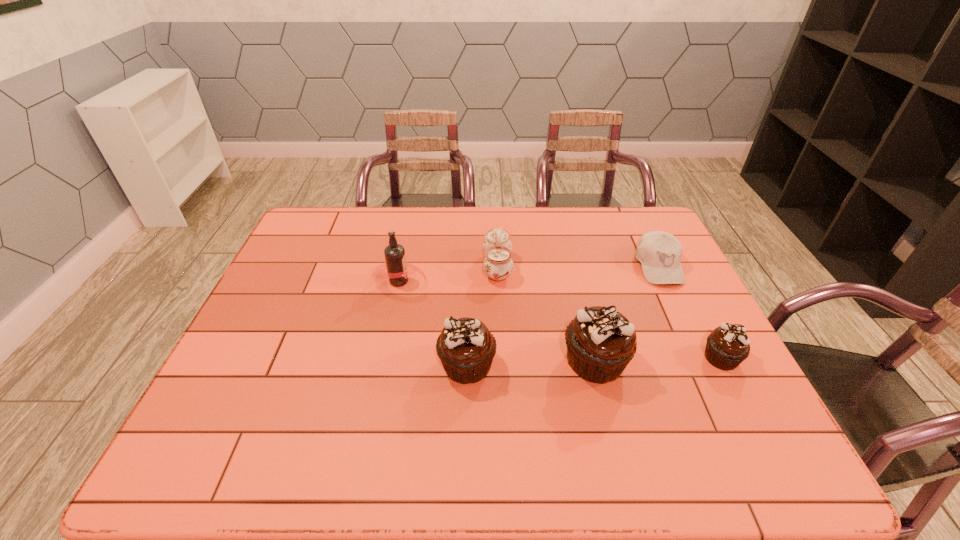
Identify the location of free point that satisfies the following two spatial constraints: 1. on the front-facing side of the baseball cap; 2. by the handle of the chinaware. (659, 267).

Where is `vacant space that satisfies the following two spatial constraints: 1. on the front-facing side of the baseball cap; 2. on the label of the leftmost object`? This screenshot has height=540, width=960. vacant space that satisfies the following two spatial constraints: 1. on the front-facing side of the baseball cap; 2. on the label of the leftmost object is located at coordinates (665, 281).

I want to click on vacant space that satisfies the following two spatial constraints: 1. on the label of the root beer; 2. on the right side of the shortest cupcake, so [384, 358].

The height and width of the screenshot is (540, 960). What are the coordinates of `vacant space that satisfies the following two spatial constraints: 1. on the front-facing side of the rightmost cupcake; 2. on the right side of the baseball cap` in the screenshot? It's located at (703, 358).